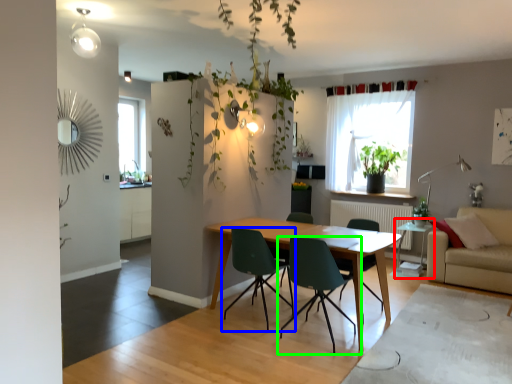
Question: Considering the real-world distances, which object is closest to side table (highlighted by a red box)? chair (highlighted by a blue box) or chair (highlighted by a green box).

Choices:
 (A) chair
 (B) chair

Answer: (B)